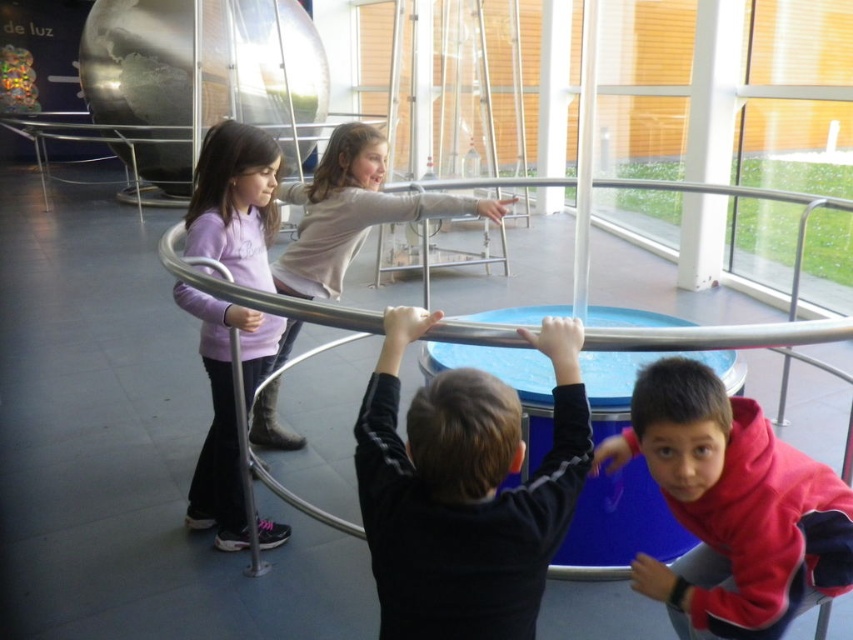
You are standing at the point with coordinates point (485, 179) and want to move to the exit located at point (753, 596). Is there any obstacle between your current position and the exit?

Point (753, 596) is in front of point (485, 179), so there is no obstacle between your current position and the exit.

In the scene shown: You are standing at the point with coordinates point (404, 212) and want to walk to the point with coordinates point (729, 548). According to the image, will you pass by the circular metal structure during your path?

Yes, you will pass by the circular metal structure because point (729, 548) is in front of point (404, 212), meaning the path from point (404, 212) to point (729, 548) would go through the circular metal structure.

You are a museum visitor trying to decide whether to let a child use the silver metallic hula hoop at center. The child is wearing the matte gray shirt at center. Based on the size of the hula hoop and the child, can the child comfortably use the hula hoop without it being too small?

The silver metallic hula hoop at center has a width larger than the matte gray shirt at center, so the child wearing the matte gray shirt at center can comfortably use the hula hoop without it being too small.